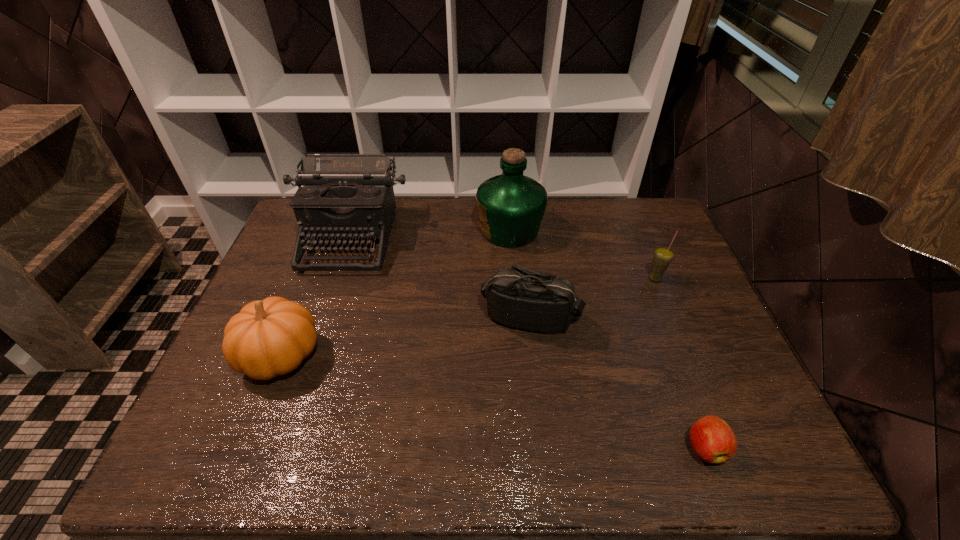
The image size is (960, 540). I want to click on straw for drinking situated at the right edge, so click(663, 256).

Where is `apple at the right edge`? The image size is (960, 540). apple at the right edge is located at coordinates (713, 440).

You are a GUI agent. You are given a task and a screenshot of the screen. Output one action in this format:
    pyautogui.click(x=<x>, y=<y>)
    Task: Click on the object at the far left corner
    
    Given the screenshot: What is the action you would take?
    pyautogui.click(x=344, y=196)

Where is `object positioned at the near right corner`? This screenshot has height=540, width=960. object positioned at the near right corner is located at coordinates (713, 440).

The height and width of the screenshot is (540, 960). In order to click on vacant space at the far edge of the desktop in this screenshot , I will do `click(420, 206)`.

In the image, there is a desktop. Where is `vacant area at the near edge`? The image size is (960, 540). vacant area at the near edge is located at coordinates point(327,442).

Find the location of `free spot at the left edge of the desktop`. free spot at the left edge of the desktop is located at coordinates (291, 284).

Find the location of a particular element. This screenshot has width=960, height=540. free space at the right edge of the desktop is located at coordinates (647, 248).

This screenshot has width=960, height=540. I want to click on free space at the far right corner of the desktop, so click(x=651, y=222).

Identify the location of free space between the tallest object and the typewriter. (430, 234).